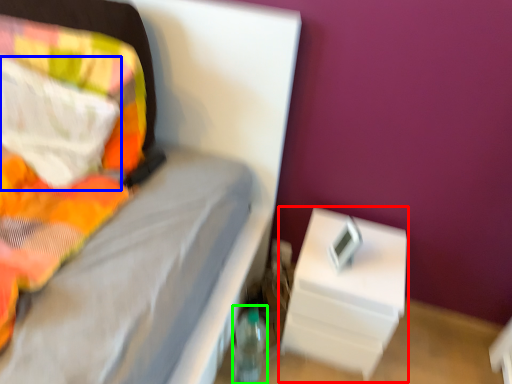
Question: Which is nearer to the nightstand (highlighted by a red box)? pillow (highlighted by a blue box) or bottle (highlighted by a green box).

Choices:
 (A) pillow
 (B) bottle

Answer: (B)